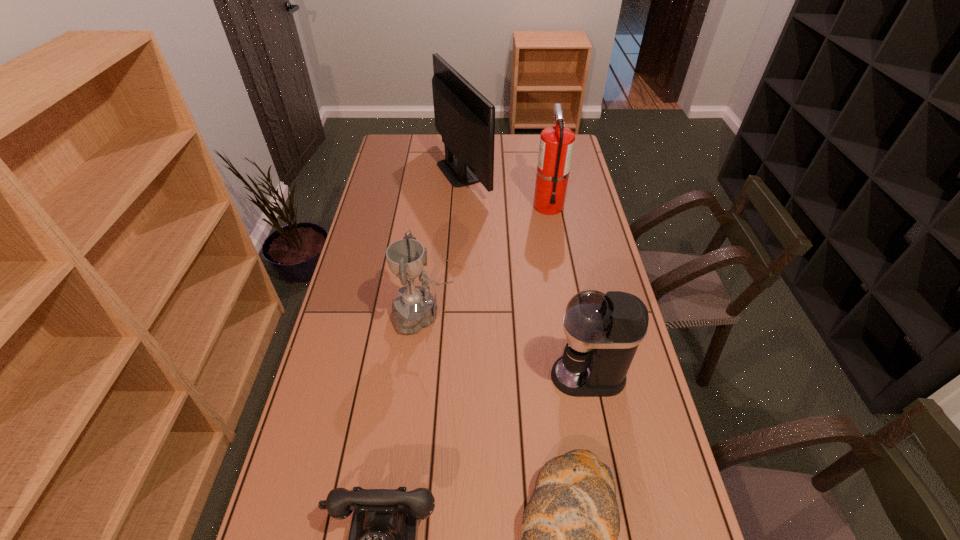
Locate an element on the screen. object that is at the far edge is located at coordinates (465, 119).

Where is `fire extinguisher at the right edge`? fire extinguisher at the right edge is located at coordinates (556, 146).

Where is `coffee maker present at the right edge`? Image resolution: width=960 pixels, height=540 pixels. coffee maker present at the right edge is located at coordinates (603, 331).

Image resolution: width=960 pixels, height=540 pixels. What are the coordinates of `vacant area at the far edge` in the screenshot? It's located at (x=420, y=153).

In the image, there is a desktop. Where is `blank space at the left edge`? Image resolution: width=960 pixels, height=540 pixels. blank space at the left edge is located at coordinates (406, 191).

This screenshot has height=540, width=960. I want to click on vacant position at the right edge of the desktop, so click(x=556, y=217).

I want to click on free space at the far left corner, so click(x=398, y=137).

The width and height of the screenshot is (960, 540). I want to click on free space that is in between the fire extinguisher and the computer monitor, so tap(506, 188).

Locate an element on the screen. This screenshot has width=960, height=540. free space that is in between the fire extinguisher and the computer monitor is located at coordinates (506, 188).

Where is `vacant point located between the third farthest object and the coffee maker`? Image resolution: width=960 pixels, height=540 pixels. vacant point located between the third farthest object and the coffee maker is located at coordinates (506, 346).